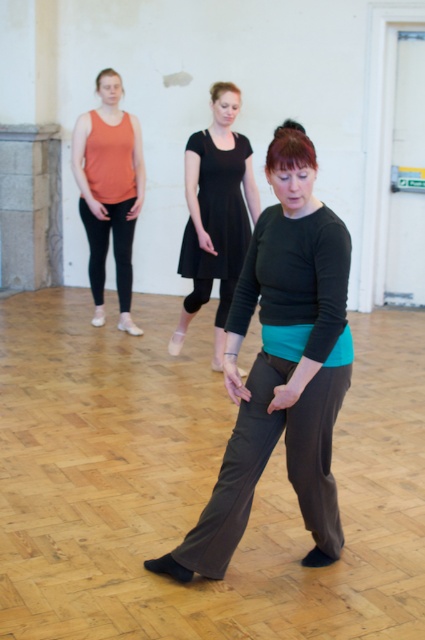
You are a photographer trying to capture the dancer in the center of the image. You notice a specific point at coordinates point (215,212). Where exactly is this point located on the dancer?

The point (215,212) is on the black matte dress at center.

You are a photographer setting up a shot in this dance studio. You want to focus on two specific points in the scene. The first point is at coordinates point (316, 288) and the second point is at point (229, 120). Which of these two points will appear larger in your photo?

Point (316, 288) is closer to the camera than point (229, 120), so it will appear larger in the photo.